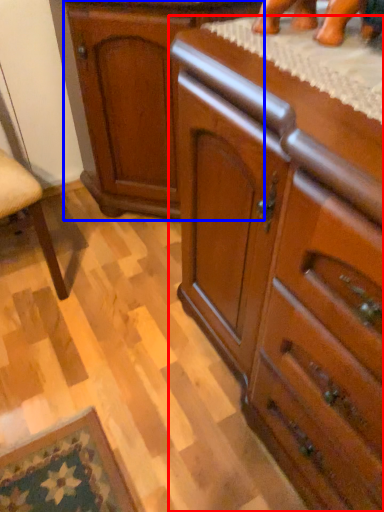
Question: Which object is further to the camera taking this photo, chest of drawers (highlighted by a red box) or cabinetry (highlighted by a blue box)?

Choices:
 (A) chest of drawers
 (B) cabinetry

Answer: (B)